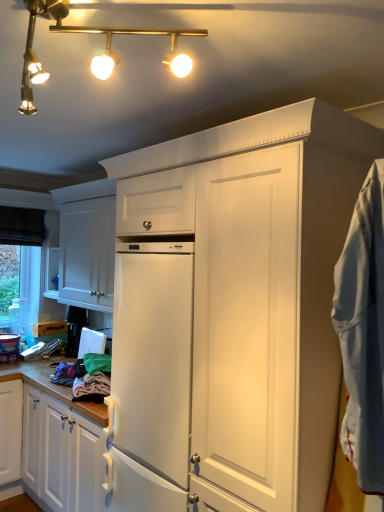
Question: In terms of height, does white cotton blanket at right look taller or shorter compared to gold metallic track lights at upper left?

Choices:
 (A) tall
 (B) short

Answer: (A)

Question: From a real-world perspective, is white cotton blanket at right physically located above or below gold metallic track lights at upper left?

Choices:
 (A) above
 (B) below

Answer: (B)

Question: Which is farther from the gold metallic track lights at upper left?

Choices:
 (A) white matte cabinet at upper left
 (B) white cotton blanket at right

Answer: (A)

Question: Based on their relative distances, which object is nearer to the gold metallic track lights at upper left?

Choices:
 (A) white matte cabinet at upper left
 (B) white cotton blanket at right

Answer: (B)